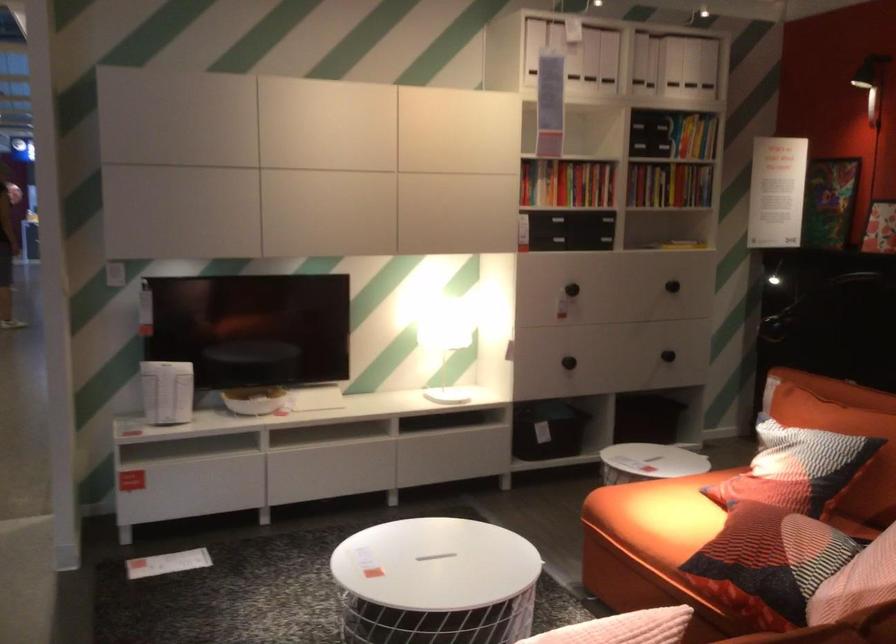
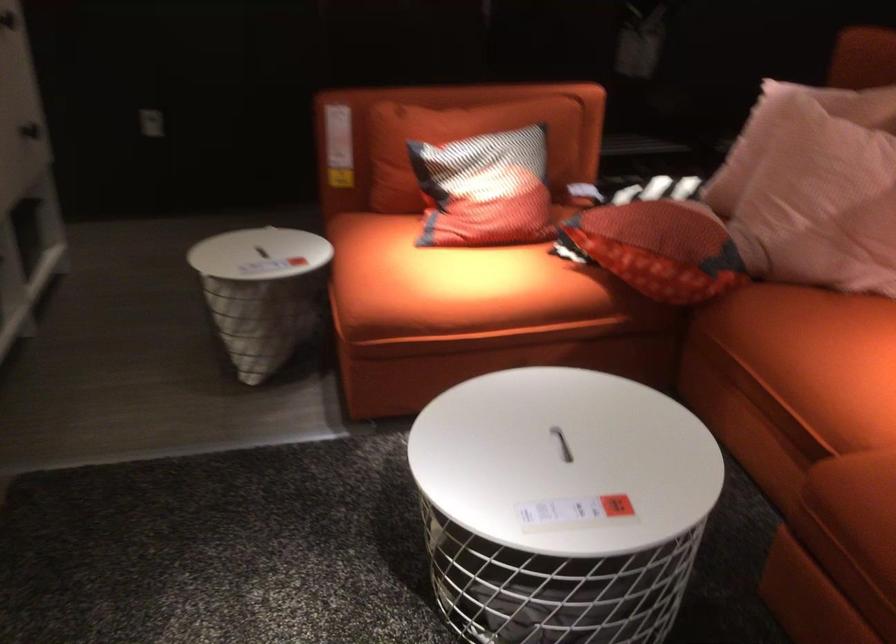
Locate, in the second image, the point that corresponds to [771,467] in the first image.

(485, 190)